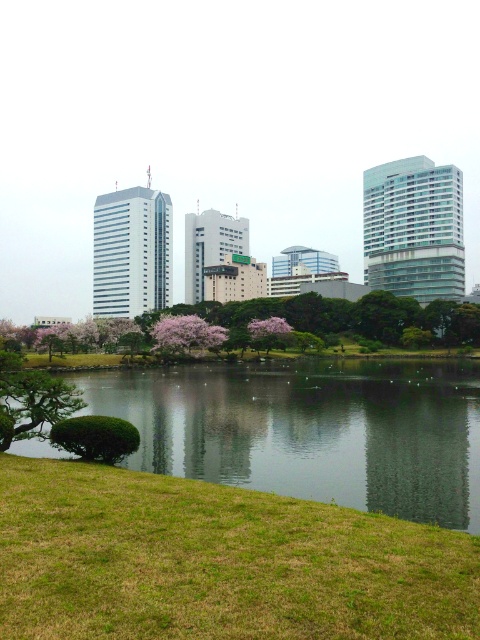
Question: Which point is farther to the camera?

Choices:
 (A) pink blossoms at center
 (B) green grassy at lower left

Answer: (A)

Question: Does pink blossoms at center have a smaller size compared to pink blossoming tree at center?

Choices:
 (A) no
 (B) yes

Answer: (A)

Question: Is green grassy bank at lower left to the left of pink matte tree at center from the viewer's perspective?

Choices:
 (A) no
 (B) yes

Answer: (A)

Question: Which point is farther from the camera taking this photo?

Choices:
 (A) (430, 321)
 (B) (264, 436)
 (C) (267, 611)
 (D) (284, 336)

Answer: (A)

Question: Is pink blossoms at center bigger than pink blossoming tree at center?

Choices:
 (A) yes
 (B) no

Answer: (A)

Question: Which object is farther from the camera taking this photo?

Choices:
 (A) green grassy bank at lower left
 (B) green grassy at lower left

Answer: (A)